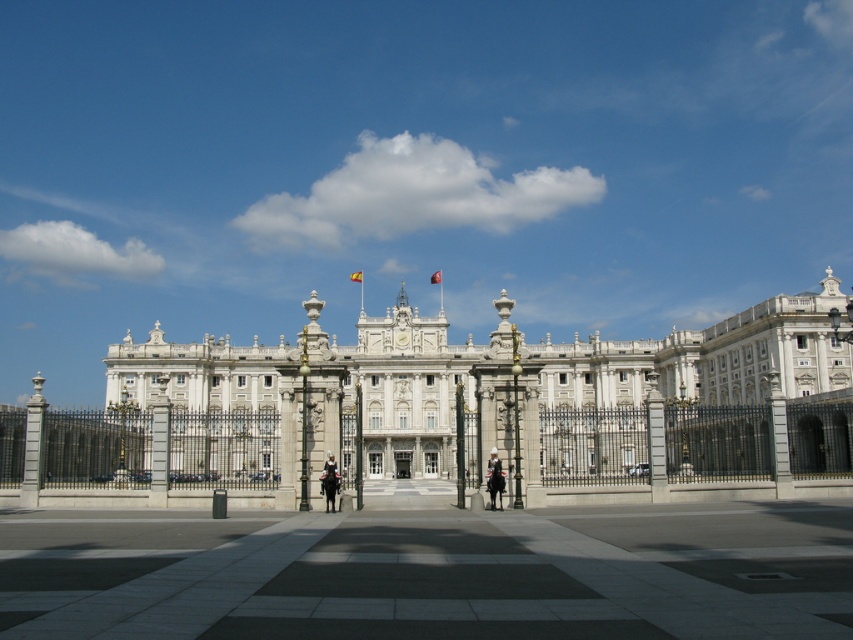
Does white stone palace at center appear on the right side of uniformed officer on horseback at center?

Correct, you'll find white stone palace at center to the right of uniformed officer on horseback at center.

Between white stone palace at center and uniformed officer on horseback at center, which one has more height?

white stone palace at center

Describe the element at coordinates (706, 358) in the screenshot. I see `white stone palace at center` at that location.

The width and height of the screenshot is (853, 640). Find the location of `white stone palace at center`. white stone palace at center is located at coordinates (706, 358).

Does white stone palace at center come behind smooth black uniform at center?

Yes, it is.

Which is more to the left, white stone palace at center or smooth black uniform at center?

From the viewer's perspective, smooth black uniform at center appears more on the left side.

This screenshot has height=640, width=853. In order to click on white stone palace at center in this screenshot , I will do `click(706, 358)`.

Can you confirm if gray concrete plaza at center is bigger than white stone palace at center?

Incorrect, gray concrete plaza at center is not larger than white stone palace at center.

Between gray concrete plaza at center and white stone palace at center, which one appears on the right side from the viewer's perspective?

white stone palace at center is more to the right.

Find the location of a particular element. gray concrete plaza at center is located at coordinates (431, 572).

Where is `gray concrete plaza at center`? gray concrete plaza at center is located at coordinates 431,572.